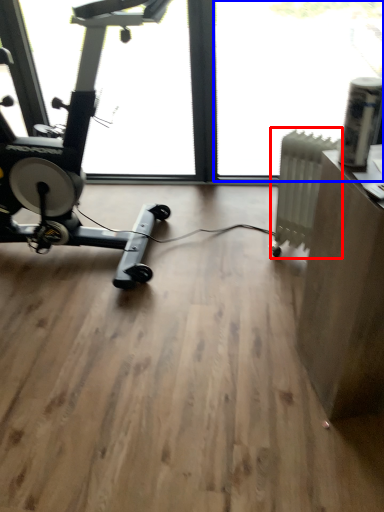
Question: Which of the following is the farthest to the observer, radiator (highlighted by a red box) or window screen (highlighted by a blue box)?

Choices:
 (A) radiator
 (B) window screen

Answer: (B)